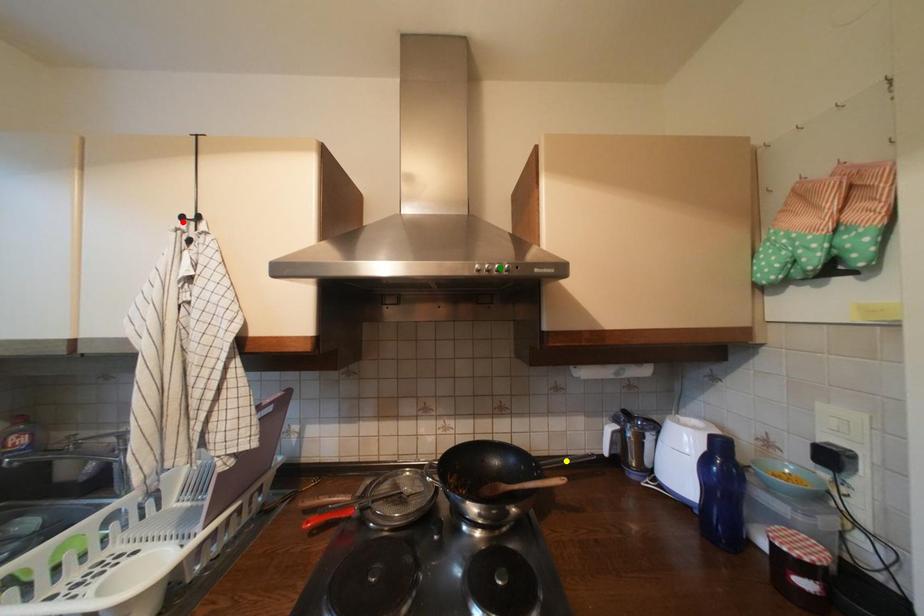
Order these from nearest to farthest:
red point
yellow point
green point

yellow point
red point
green point